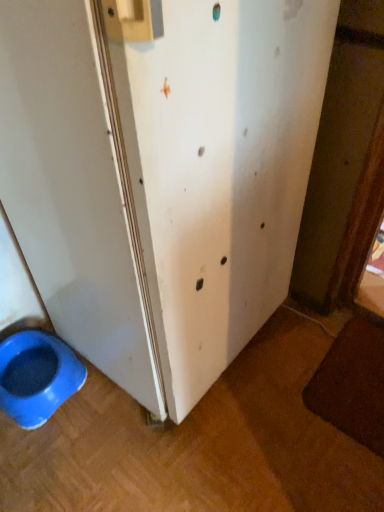
Question: Considering the relative positions of blue plastic bowl at lower left and white matte screen door at lower left in the image provided, is blue plastic bowl at lower left to the right of white matte screen door at lower left from the viewer's perspective?

Choices:
 (A) no
 (B) yes

Answer: (A)

Question: Does blue plastic bowl at lower left come behind white matte screen door at lower left?

Choices:
 (A) yes
 (B) no

Answer: (A)

Question: Is blue plastic bowl at lower left facing away from white matte screen door at lower left?

Choices:
 (A) yes
 (B) no

Answer: (B)

Question: Is blue plastic bowl at lower left wider than white matte screen door at lower left?

Choices:
 (A) yes
 (B) no

Answer: (B)

Question: Would you say blue plastic bowl at lower left is outside white matte screen door at lower left?

Choices:
 (A) yes
 (B) no

Answer: (A)

Question: Considering the relative sizes of blue plastic bowl at lower left and white matte screen door at lower left in the image provided, is blue plastic bowl at lower left shorter than white matte screen door at lower left?

Choices:
 (A) no
 (B) yes

Answer: (B)

Question: Does white matte screen door at lower left have a lesser width compared to blue plastic bowl at lower left?

Choices:
 (A) yes
 (B) no

Answer: (B)

Question: Can you confirm if white matte screen door at lower left is taller than blue plastic bowl at lower left?

Choices:
 (A) yes
 (B) no

Answer: (A)

Question: Is white matte screen door at lower left bigger than blue plastic bowl at lower left?

Choices:
 (A) yes
 (B) no

Answer: (A)

Question: Does white matte screen door at lower left have a lesser height compared to blue plastic bowl at lower left?

Choices:
 (A) yes
 (B) no

Answer: (B)

Question: Could you tell me if white matte screen door at lower left is facing blue plastic bowl at lower left?

Choices:
 (A) yes
 (B) no

Answer: (B)

Question: From the image's perspective, is white matte screen door at lower left under blue plastic bowl at lower left?

Choices:
 (A) yes
 (B) no

Answer: (B)

Question: Based on their positions, is white matte screen door at lower left located to the left or right of blue plastic bowl at lower left?

Choices:
 (A) left
 (B) right

Answer: (B)